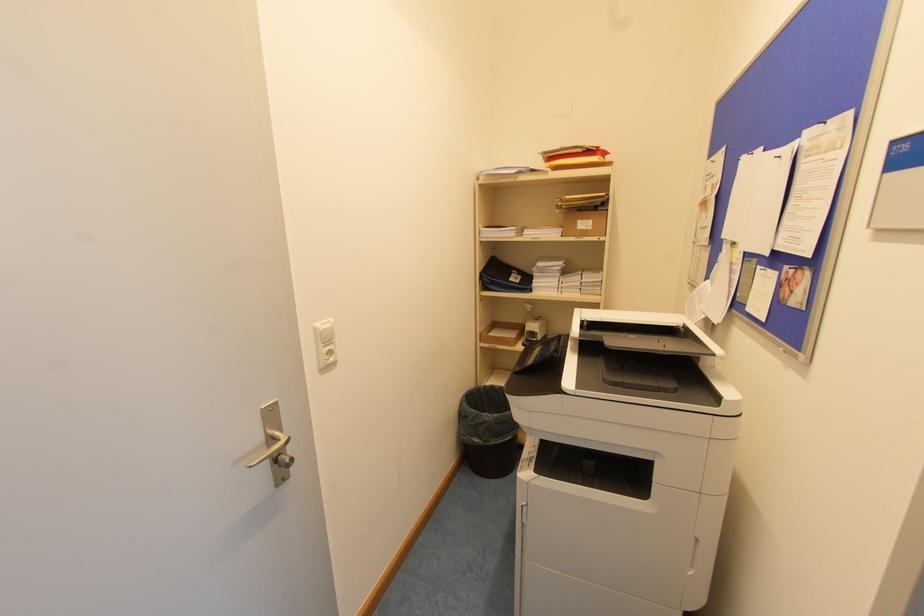
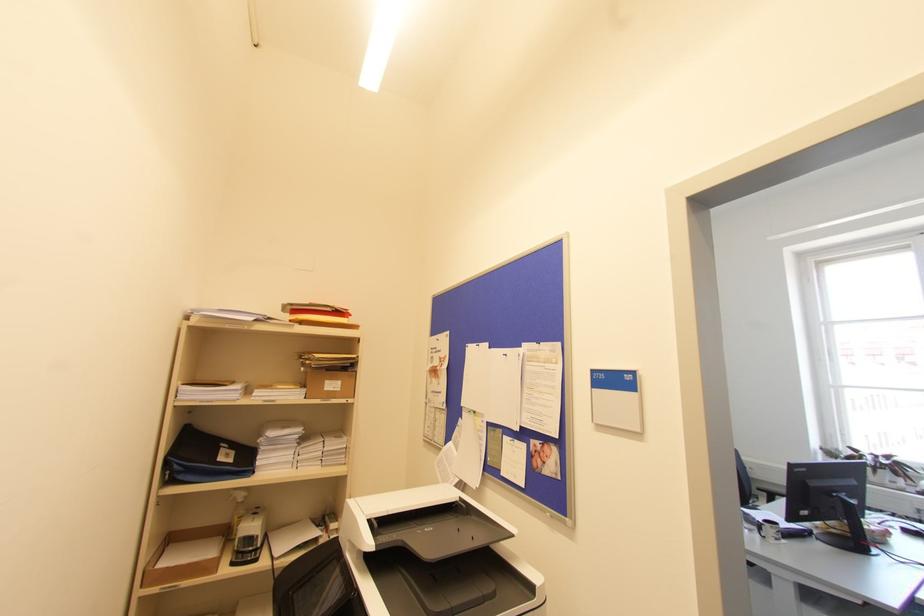
Looking at this image, the images are taken continuously from a first-person perspective. In which direction is your viewpoint rotating?

The camera's rotation is toward right-up.